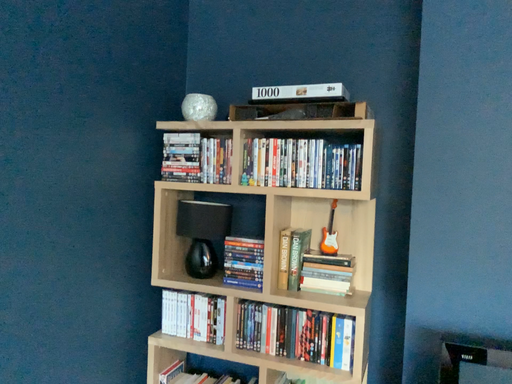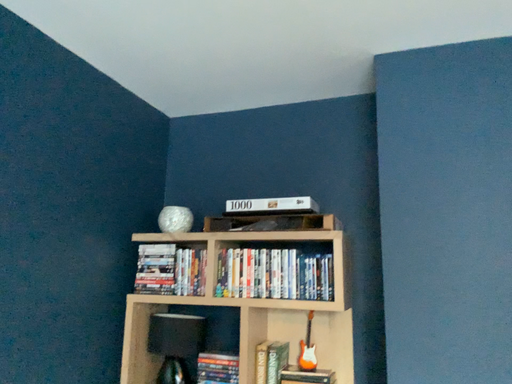
Question: How did the camera likely rotate when shooting the video?

Choices:
 (A) rotated upward
 (B) rotated downward

Answer: (A)